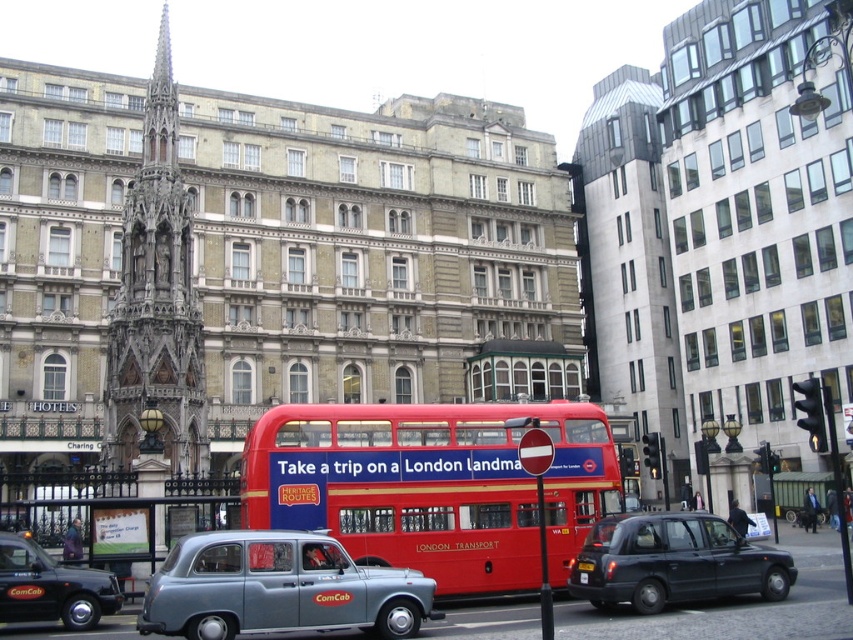
Between black matte taxi at lower left and yellow plastic license plate at center, which one is positioned lower?

yellow plastic license plate at center is below.

Which is more to the left, black matte taxi at lower left or yellow plastic license plate at center?

black matte taxi at lower left is more to the left.

What are the coordinates of `black matte taxi at lower left` in the screenshot? It's located at (51, 588).

I want to click on black matte taxi at lower left, so click(51, 588).

Can you confirm if black rubber taxi at lower right is thinner than black plastic license plate at center?

No, black rubber taxi at lower right is not thinner than black plastic license plate at center.

Does black rubber taxi at lower right have a larger size compared to black plastic license plate at center?

Correct, black rubber taxi at lower right is larger in size than black plastic license plate at center.

Between point (585, 538) and point (592, 561), which one is positioned in front?

Point (592, 561) is in front.

Image resolution: width=853 pixels, height=640 pixels. What are the coordinates of `black rubber taxi at lower right` in the screenshot? It's located at (675, 561).

Between black matte taxi at lower left and black plastic license plate at center, which one has less height?

black plastic license plate at center is shorter.

Consider the image. Who is lower down, black matte taxi at lower left or black plastic license plate at center?

Positioned lower is black matte taxi at lower left.

Is point (54, 589) positioned behind point (590, 566)?

That is False.

Identify the location of black matte taxi at lower left. (51, 588).